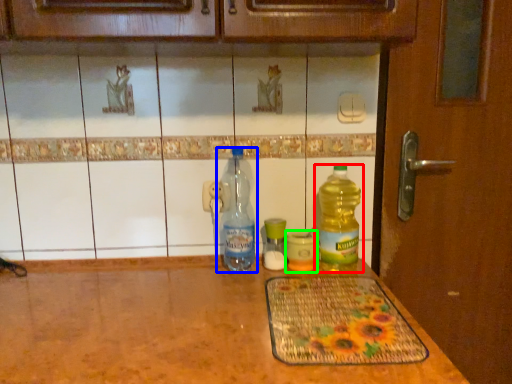
Question: Which is nearer to the bottle (highlighted by a red box)? bottle (highlighted by a blue box) or bottle (highlighted by a green box).

Choices:
 (A) bottle
 (B) bottle

Answer: (B)